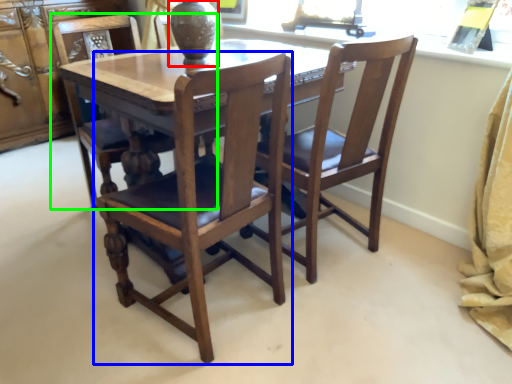
Question: Which object is positioned farthest from glass vase (highlighted by a red box)? Select from chair (highlighted by a blue box) and chair (highlighted by a green box).

Choices:
 (A) chair
 (B) chair

Answer: (A)